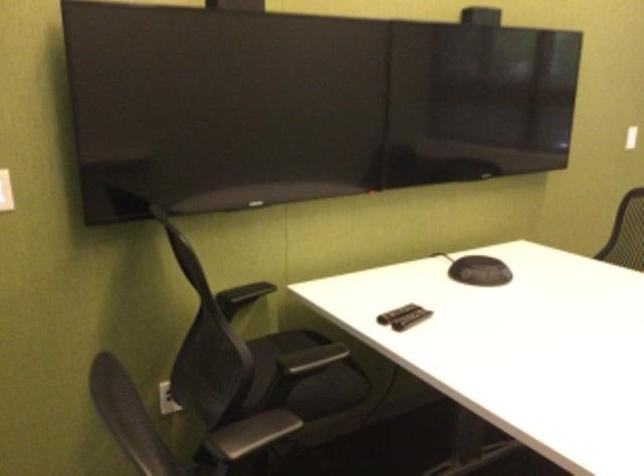
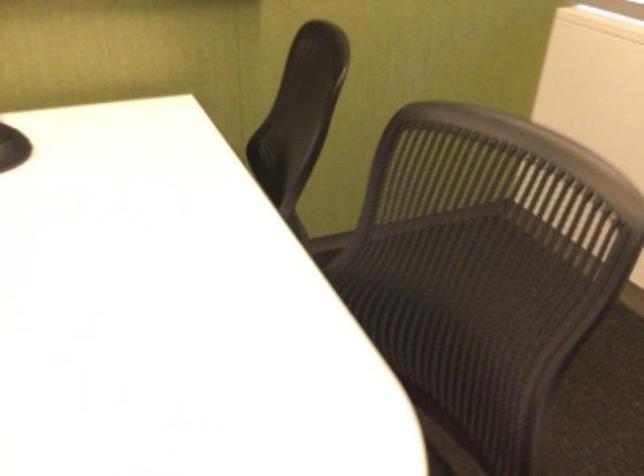
The images are taken continuously from a first-person perspective. In which direction are you moving?

The cameraman moved toward right, forward.